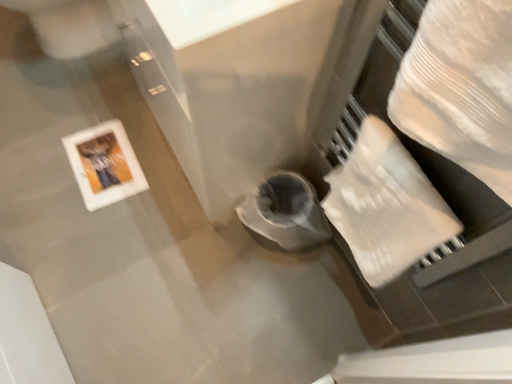
The image size is (512, 384). What are the coordinates of `vacant region under white glossy picture frame at upper left (from a real-world perspective)` in the screenshot? It's located at (99, 165).